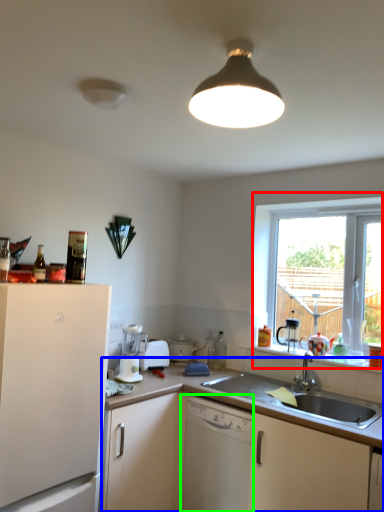
Question: Which object is the closest to the window (highlighted by a red box)? Choose among these: cabinetry (highlighted by a blue box) or dishwasher (highlighted by a green box).

Choices:
 (A) cabinetry
 (B) dishwasher

Answer: (A)